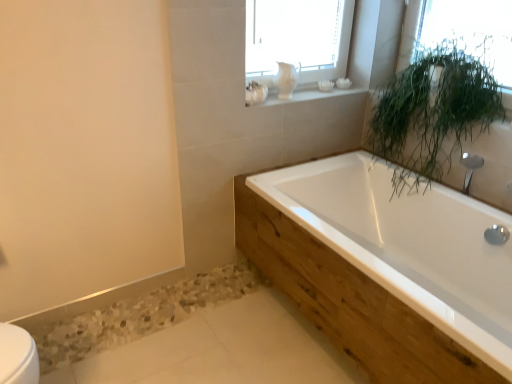
Find the location of a particular element. green leafy plant at upper right is located at coordinates (434, 111).

The width and height of the screenshot is (512, 384). In order to click on white glossy bathtub at center in this screenshot , I will do `click(412, 245)`.

Is green leafy plant at upper right taller than green leafy plant at upper right?

Indeed, green leafy plant at upper right has a greater height compared to green leafy plant at upper right.

How different are the orientations of green leafy plant at upper right and green leafy plant at upper right in degrees?

0.255 degrees.

Which is behind, point (459, 47) or point (503, 27)?

The point (459, 47) is more distant.

Find the location of a particular element. houseplant located in front of the green leafy plant at upper right is located at coordinates (434, 111).

Is white ceramic objects at upper center inside or outside of white glossy bathtub at center?

white ceramic objects at upper center is not enclosed by white glossy bathtub at center.

Are white ceramic objects at upper center and white glossy bathtub at center located far from each other?

Actually, white ceramic objects at upper center and white glossy bathtub at center are a little close together.

Considering the relative sizes of white ceramic objects at upper center and white glossy bathtub at center in the image provided, is white ceramic objects at upper center smaller than white glossy bathtub at center?

Correct, white ceramic objects at upper center occupies less space than white glossy bathtub at center.

Could you tell me if white ceramic objects at upper center is turned towards white glossy bathtub at center?

No, white ceramic objects at upper center is not aimed at white glossy bathtub at center.

Considering the relative sizes of white glossy bathtub at center and white ceramic objects at upper center in the image provided, is white glossy bathtub at center smaller than white ceramic objects at upper center?

Incorrect, white glossy bathtub at center is not smaller in size than white ceramic objects at upper center.

From the image's perspective, relative to white ceramic objects at upper center, is white glossy bathtub at center above or below?

white glossy bathtub at center is below white ceramic objects at upper center.

Is the depth of white glossy bathtub at center greater than that of white ceramic objects at upper center?

No, white glossy bathtub at center is closer to the camera.

Considering the sizes of white glossy bathtub at center and white ceramic objects at upper center in the image, is white glossy bathtub at center wider or thinner than white ceramic objects at upper center?

Clearly, white glossy bathtub at center has more width compared to white ceramic objects at upper center.

Is white glossy bathtub at center further to the viewer compared to green leafy plant at upper right?

No.

The image size is (512, 384). Identify the location of window behind the white glossy bathtub at center. (469, 33).

From the image's perspective, is white glossy bathtub at center located above or below green leafy plant at upper right?

white glossy bathtub at center is situated lower than green leafy plant at upper right in the image.

Is white glossy bathtub at center facing towards green leafy plant at upper right?

No.

Where is `houseplant lying above the white glossy bathtub at center (from the image's perspective)`? The image size is (512, 384). houseplant lying above the white glossy bathtub at center (from the image's perspective) is located at coordinates (434, 111).

From the picture: What's the angular difference between white glossy bathtub at center and green leafy plant at upper right's facing directions?

white glossy bathtub at center and green leafy plant at upper right are facing 0.414 degrees away from each other.

Is white glossy bathtub at center looking in the opposite direction of green leafy plant at upper right?

No, white glossy bathtub at center is not facing away from green leafy plant at upper right.

Could white ceramic objects at upper center be considered to be inside green leafy plant at upper right?

No, green leafy plant at upper right does not contain white ceramic objects at upper center.

What are the coordinates of `window sill located above the green leafy plant at upper right (from a real-world perspective)` in the screenshot? It's located at (297, 95).

Consider the image. In the image, is green leafy plant at upper right on the left side or the right side of white ceramic objects at upper center?

Based on their positions, green leafy plant at upper right is located to the right of white ceramic objects at upper center.

Is point (477, 50) farther from viewer compared to point (297, 88)?

No, (477, 50) is in front of (297, 88).

Considering the relative positions of green leafy plant at upper right and green leafy plant at upper right in the image provided, is green leafy plant at upper right to the left of green leafy plant at upper right from the viewer's perspective?

In fact, green leafy plant at upper right is to the right of green leafy plant at upper right.

Is green leafy plant at upper right shorter than green leafy plant at upper right?

Correct, green leafy plant at upper right is not as tall as green leafy plant at upper right.

Does green leafy plant at upper right contain green leafy plant at upper right?

Actually, green leafy plant at upper right is outside green leafy plant at upper right.

In the image, there is a green leafy plant at upper right. Identify the location of window above it (from the image's perspective). The width and height of the screenshot is (512, 384). (469, 33).

Image resolution: width=512 pixels, height=384 pixels. Identify the location of bathtub below the white ceramic objects at upper center (from the image's perspective). (412, 245).

Estimate the real-world distances between objects in this image. Which object is closer to white glossy bathtub at center, green leafy plant at upper right or white ceramic objects at upper center?

white ceramic objects at upper center.

Looking at the image, which one is located closer to green leafy plant at upper right, green leafy plant at upper right or white glossy bathtub at center?

green leafy plant at upper right.

Considering their positions, is white glossy bathtub at center positioned closer to green leafy plant at upper right than green leafy plant at upper right?

Based on the image, green leafy plant at upper right appears to be nearer to green leafy plant at upper right.

Considering their positions, is white ceramic objects at upper center positioned further to green leafy plant at upper right than green leafy plant at upper right?

Based on the image, white ceramic objects at upper center appears to be further to green leafy plant at upper right.

Looking at the image, which one is located closer to green leafy plant at upper right, white glossy bathtub at center or white ceramic objects at upper center?

white ceramic objects at upper center is positioned closer to the anchor green leafy plant at upper right.

Looking at the image, which one is located closer to green leafy plant at upper right, green leafy plant at upper right or white ceramic objects at upper center?

green leafy plant at upper right lies closer to green leafy plant at upper right than the other object.

Based on their spatial positions, is green leafy plant at upper right or white glossy bathtub at center further from white ceramic objects at upper center?

white glossy bathtub at center lies further to white ceramic objects at upper center than the other object.

Based on their spatial positions, is white glossy bathtub at center or green leafy plant at upper right closer to green leafy plant at upper right?

green leafy plant at upper right lies closer to green leafy plant at upper right than the other object.

Find the location of a particular element. The width and height of the screenshot is (512, 384). houseplant positioned between white glossy bathtub at center and white ceramic objects at upper center from near to far is located at coordinates (434, 111).

At what (x,y) coordinates should I click in order to perform the action: click on houseplant between green leafy plant at upper right and white glossy bathtub at center from top to bottom. Please return your answer as a coordinate pair (x, y). Image resolution: width=512 pixels, height=384 pixels. Looking at the image, I should click on (434, 111).

You are a GUI agent. You are given a task and a screenshot of the screen. Output one action in this format:
    pyautogui.click(x=<x>, y=<y>)
    Task: Click on the window sill between green leafy plant at upper right and white glossy bathtub at center vertically
    
    Given the screenshot: What is the action you would take?
    pyautogui.click(x=297, y=95)

The height and width of the screenshot is (384, 512). I want to click on houseplant located between white ceramic objects at upper center and green leafy plant at upper right in the left-right direction, so click(x=434, y=111).